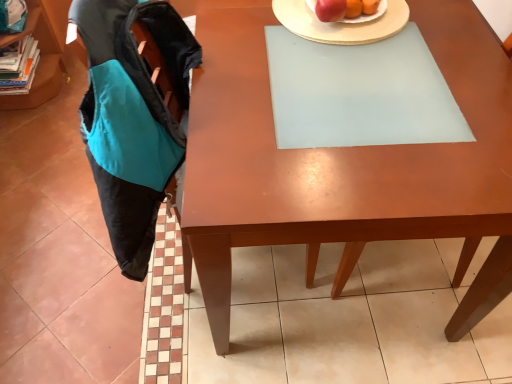
Consider the image. What is the approximate width of matte wooden desk at center?

It is 83.85 centimeters.

This screenshot has width=512, height=384. Describe the element at coordinates (342, 23) in the screenshot. I see `white ceramic plate at upper center` at that location.

Where is `matte wooden desk at center`? Image resolution: width=512 pixels, height=384 pixels. matte wooden desk at center is located at coordinates (344, 164).

Measure the distance between white ceramic plate at upper center and black fabric swivel chair at left.

They are 49.96 centimeters apart.

Is white ceramic plate at upper center far away from black fabric swivel chair at left?

No, white ceramic plate at upper center is not far from black fabric swivel chair at left.

Considering the relative positions of white ceramic plate at upper center and black fabric swivel chair at left in the image provided, is white ceramic plate at upper center in front of black fabric swivel chair at left?

No.

Choose the correct answer: Is white ceramic plate at upper center inside black fabric swivel chair at left or outside it?

white ceramic plate at upper center exists outside the volume of black fabric swivel chair at left.

Between point (321, 3) and point (20, 67), which one is positioned in front?

Positioned in front is point (321, 3).

Is red matte apple at upper center facing away from teal fabric book at left?

red matte apple at upper center is not turned away from teal fabric book at left.

In the scene shown: Considering the relative positions of red matte apple at upper center and teal fabric book at left in the image provided, is red matte apple at upper center to the left of teal fabric book at left from the viewer's perspective?

No, red matte apple at upper center is not to the left of teal fabric book at left.

Is teal fabric shelf at upper left closer to the viewer compared to red matte apple at upper center?

That is False.

Measure the distance between teal fabric shelf at upper left and red matte apple at upper center.

They are 1.57 meters apart.

Can you tell me how much teal fabric shelf at upper left and red matte apple at upper center differ in facing direction?

The angular difference between teal fabric shelf at upper left and red matte apple at upper center is 0.000421 degrees.

Which is more to the right, teal fabric shelf at upper left or red matte apple at upper center?

red matte apple at upper center is more to the right.

Relative to black fabric swivel chair at left, is shiny red apple at upper center in front or behind?

Visually, shiny red apple at upper center is located behind black fabric swivel chair at left.

Is shiny red apple at upper center aimed at black fabric swivel chair at left?

No, shiny red apple at upper center does not turn towards black fabric swivel chair at left.

Is shiny red apple at upper center at the left side of black fabric swivel chair at left?

No.

Which is in front, point (347, 5) or point (119, 161)?

The point (119, 161) is in front.

From a real-world perspective, is teal fabric book at left under black fabric swivel chair at left?

Yes, from a real-world perspective, teal fabric book at left is beneath black fabric swivel chair at left.

In the image, there is a black fabric swivel chair at left. At what (x,y) coordinates should I click in order to perform the action: click on book above it (from the image's perspective). Please return your answer as a coordinate pair (x, y). The height and width of the screenshot is (384, 512). Looking at the image, I should click on (19, 67).

From the image's perspective, would you say teal fabric book at left is shown under black fabric swivel chair at left?

No.

Is teal fabric book at left behind black fabric swivel chair at left?

Yes.

Which of these two, red matte apple at upper center or shiny red apple at upper center, is smaller?

red matte apple at upper center.

Considering the sizes of objects red matte apple at upper center and shiny red apple at upper center in the image provided, who is shorter, red matte apple at upper center or shiny red apple at upper center?

With less height is shiny red apple at upper center.

Are red matte apple at upper center and shiny red apple at upper center located far from each other?

No.

Does black fabric swivel chair at left appear on the right side of white ceramic plate at upper center?

Incorrect, black fabric swivel chair at left is not on the right side of white ceramic plate at upper center.

From a real-world perspective, which is physically below, black fabric swivel chair at left or white ceramic plate at upper center?

From a 3D spatial view, black fabric swivel chair at left is below.

Does point (123, 110) lie behind point (279, 0)?

That is False.

Identify the location of plate above the black fabric swivel chair at left (from a real-world perspective). The image size is (512, 384). (342, 23).

This screenshot has height=384, width=512. Identify the location of apple on the right of teal fabric book at left. (330, 10).

Estimate the real-world distances between objects in this image. Which object is further from matte wooden desk at center, red matte apple at upper center or shiny red apple at upper center?

The object further to matte wooden desk at center is red matte apple at upper center.

Based on their spatial positions, is black fabric swivel chair at left or teal fabric book at left closer to teal fabric shelf at upper left?

The object closer to teal fabric shelf at upper left is teal fabric book at left.

Based on their spatial positions, is white ceramic plate at upper center or matte wooden desk at center further from shiny red apple at upper center?

Based on the image, matte wooden desk at center appears to be further to shiny red apple at upper center.

Based on their spatial positions, is teal fabric shelf at upper left or teal fabric book at left closer to black fabric swivel chair at left?

teal fabric book at left is closer to black fabric swivel chair at left.

Which object lies nearer to the anchor point black fabric swivel chair at left, teal fabric shelf at upper left or red matte apple at upper center?

red matte apple at upper center lies closer to black fabric swivel chair at left than the other object.

From the image, which object appears to be nearer to teal fabric book at left, matte wooden desk at center or red matte apple at upper center?

The object closer to teal fabric book at left is red matte apple at upper center.

Based on their spatial positions, is teal fabric shelf at upper left or white ceramic plate at upper center closer to teal fabric book at left?

Among the two, teal fabric shelf at upper left is located nearer to teal fabric book at left.

Considering their positions, is shiny red apple at upper center positioned closer to teal fabric book at left than white ceramic plate at upper center?

The object closer to teal fabric book at left is white ceramic plate at upper center.

Where is `desk between teal fabric shelf at upper left and shiny red apple at upper center from left to right`? The image size is (512, 384). desk between teal fabric shelf at upper left and shiny red apple at upper center from left to right is located at coordinates (344, 164).

Locate an element on the screen. shelf located between black fabric swivel chair at left and teal fabric book at left in the depth direction is located at coordinates (42, 52).

Find the location of `swivel chair between teal fabric shelf at upper left and white ceramic plate at upper center in the horizontal direction`. swivel chair between teal fabric shelf at upper left and white ceramic plate at upper center in the horizontal direction is located at coordinates (132, 118).

You are a GUI agent. You are given a task and a screenshot of the screen. Output one action in this format:
    pyautogui.click(x=<x>, y=<y>)
    Task: Click on the swivel chair situated between teal fabric shelf at upper left and red matte apple at upper center from left to right
    
    Given the screenshot: What is the action you would take?
    pyautogui.click(x=132, y=118)